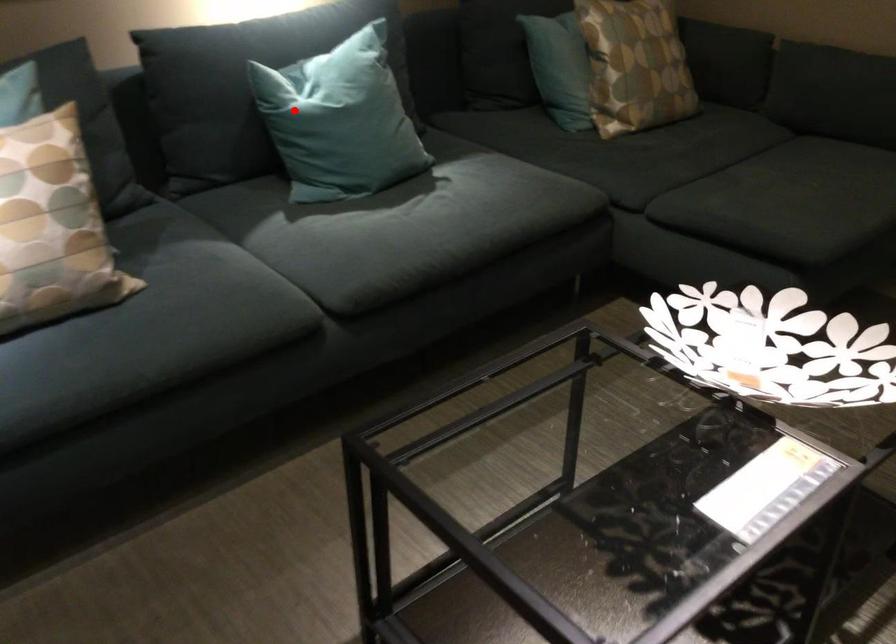
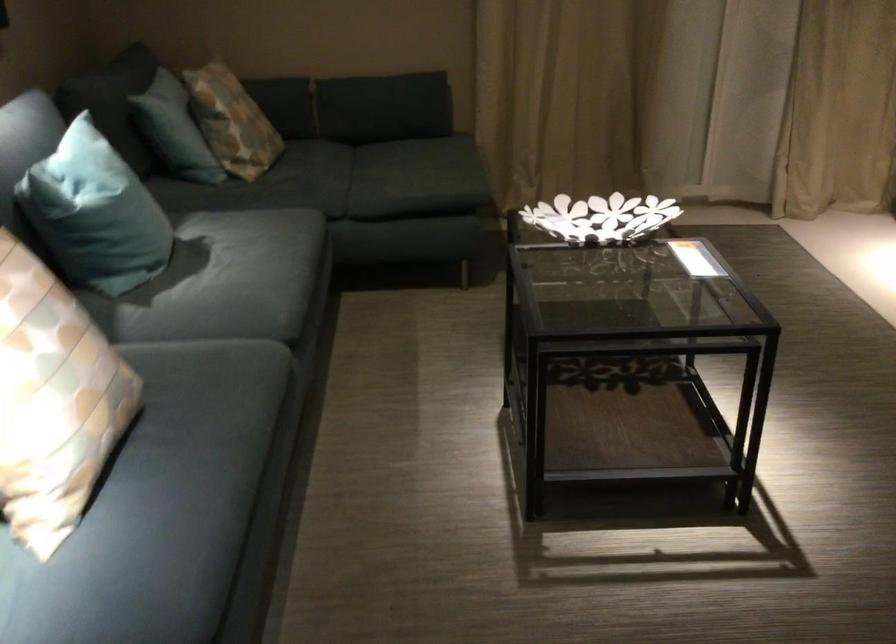
Where in the second image is the point corresponding to the highlighted location from the first image?

(95, 214)